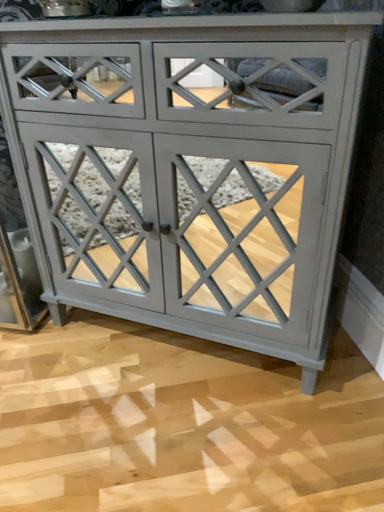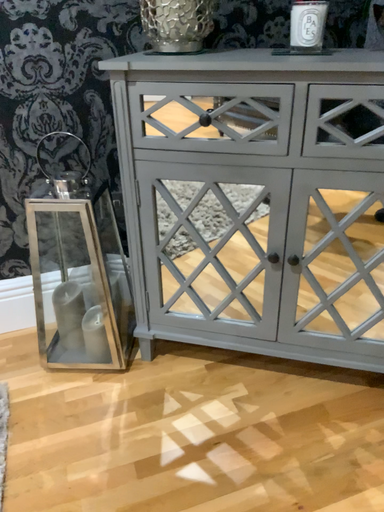
Question: How did the camera likely rotate when shooting the video?

Choices:
 (A) rotated left
 (B) rotated right

Answer: (B)